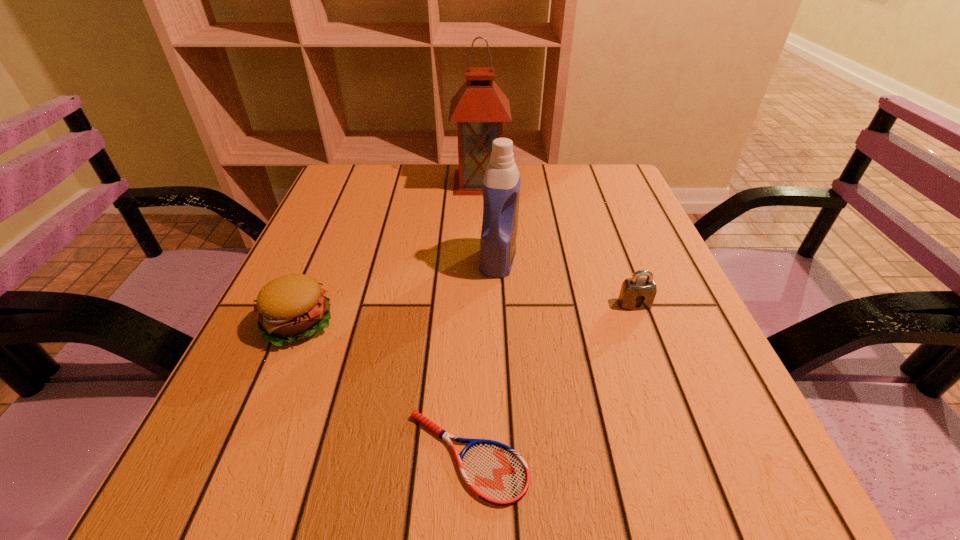
Locate an element on the screen. The height and width of the screenshot is (540, 960). free space at the right edge of the desktop is located at coordinates (624, 239).

Identify the location of free region at the far left corner. pyautogui.click(x=376, y=170).

I want to click on vacant point at the near left corner, so click(x=172, y=515).

Where is `vacant space at the far right corner of the desktop`? vacant space at the far right corner of the desktop is located at coordinates point(570,167).

Locate an element on the screen. This screenshot has height=540, width=960. free spot at the near right corner of the desktop is located at coordinates (735, 502).

Where is `vacant point located between the tennis racket and the detergent`? Image resolution: width=960 pixels, height=540 pixels. vacant point located between the tennis racket and the detergent is located at coordinates (483, 357).

Identify the location of free area in between the nearest object and the rightmost object. The image size is (960, 540). (551, 380).

Image resolution: width=960 pixels, height=540 pixels. Identify the location of empty location between the detergent and the tennis racket. (483, 357).

Identify the location of free space between the detergent and the rightmost object. This screenshot has width=960, height=540. (566, 281).

You are a GUI agent. You are given a task and a screenshot of the screen. Output one action in this format:
    pyautogui.click(x=<x>, y=<y>)
    Task: Click on the vacant area between the rightmost object and the farthest object
    
    Given the screenshot: What is the action you would take?
    pyautogui.click(x=557, y=243)